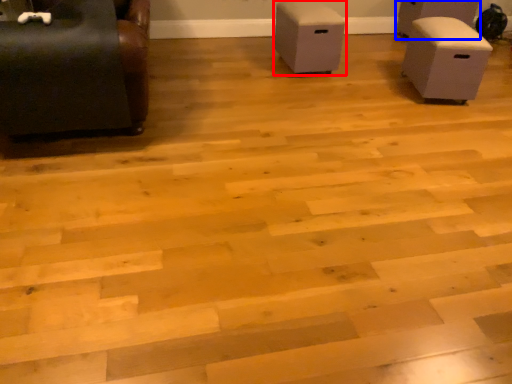
Question: Among these objects, which one is farthest to the camera, furniture (highlighted by a red box) or furniture (highlighted by a blue box)?

Choices:
 (A) furniture
 (B) furniture

Answer: (B)